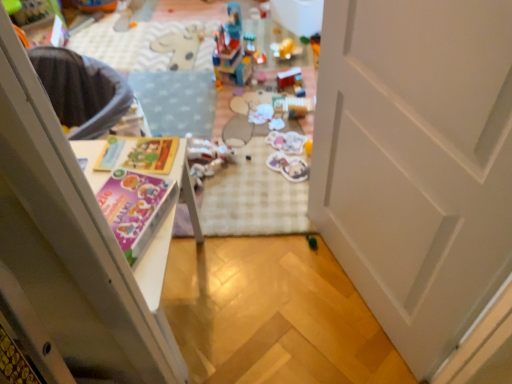
What are the coordinates of `vacant space positioned to the left of matte plastic stickers at center, the second toy from the bottom` in the screenshot? It's located at (248, 168).